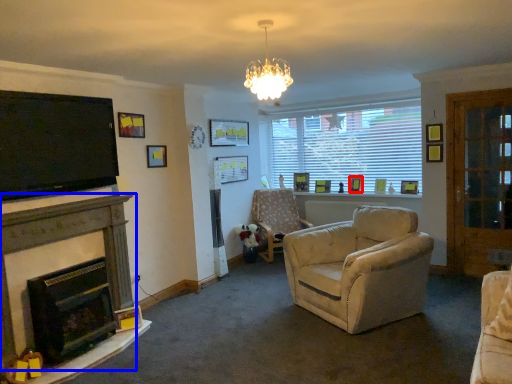
Question: Which point is closer to the camera, picture frame (highlighted by a red box) or fireplace (highlighted by a blue box)?

Choices:
 (A) picture frame
 (B) fireplace

Answer: (B)